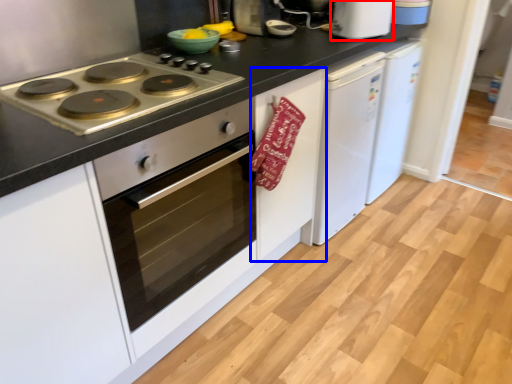
Question: Among these objects, which one is farthest to the camera, kitchen appliance (highlighted by a red box) or cabinetry (highlighted by a blue box)?

Choices:
 (A) kitchen appliance
 (B) cabinetry

Answer: (A)